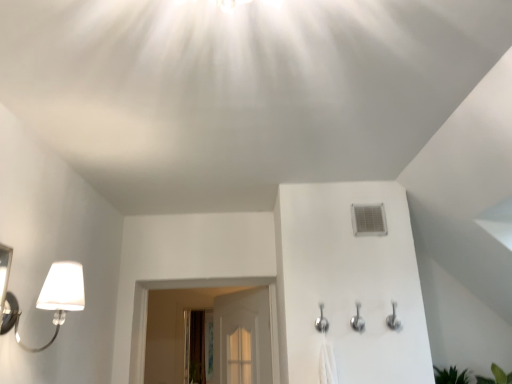
Question: From their relative heights in the image, would you say white plastic air conditioner at upper right is taller or shorter than silver metallic shower head at center?

Choices:
 (A) short
 (B) tall

Answer: (B)

Question: Is white plastic air conditioner at upper right bigger or smaller than silver metallic shower head at center?

Choices:
 (A) big
 (B) small

Answer: (B)

Question: Estimate the real-world distances between objects in this image. Which object is farther from the green leafy plant at lower right?

Choices:
 (A) white matte lamp at left
 (B) silver metallic shower head at center
 (C) white plastic air conditioner at upper right
 (D) clear glass screen door at center

Answer: (D)

Question: Estimate the real-world distances between objects in this image. Which object is farther from the green leafy plant at lower right?

Choices:
 (A) white matte lamp at left
 (B) clear glass screen door at center
 (C) white plastic air conditioner at upper right
 (D) silver metallic shower head at center

Answer: (B)